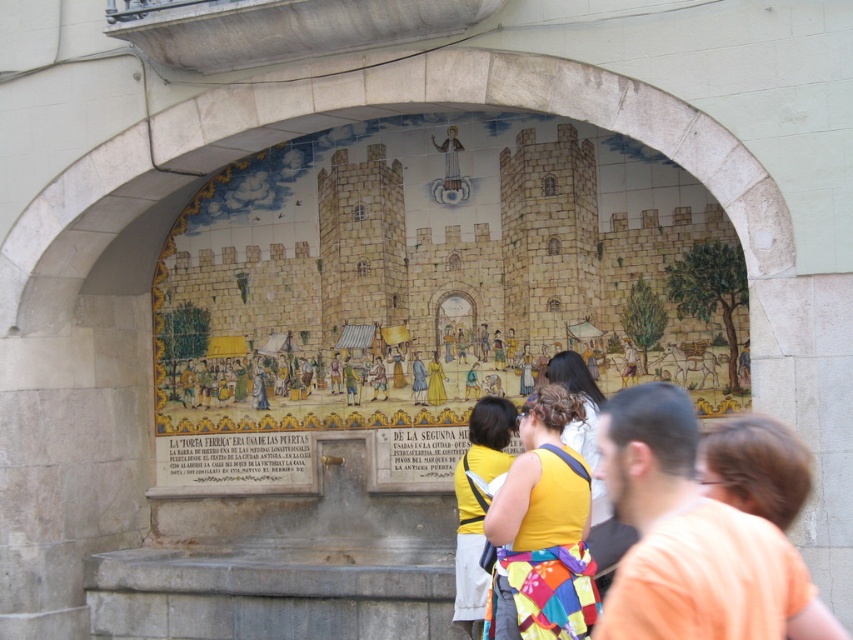
Question: Does orange cotton shirt at lower right appear under yellow fabric backpack at center?

Choices:
 (A) yes
 (B) no

Answer: (B)

Question: Which point appears farthest from the camera in this image?

Choices:
 (A) (469, 515)
 (B) (498, 518)
 (C) (807, 458)

Answer: (A)

Question: Which of the following is the farthest from the observer?

Choices:
 (A) coord(618,428)
 (B) coord(440,182)
 (C) coord(596,492)

Answer: (B)

Question: Is orange cotton shirt at lower right bigger than yellow fabric bag at center?

Choices:
 (A) yes
 (B) no

Answer: (A)

Question: Among these objects, which one is farthest from the camera?

Choices:
 (A) orange cotton shirt at lower right
 (B) yellow fabric at center

Answer: (B)

Question: Can you confirm if earthy stone castle at center is positioned below yellow fabric bag at center?

Choices:
 (A) no
 (B) yes

Answer: (A)